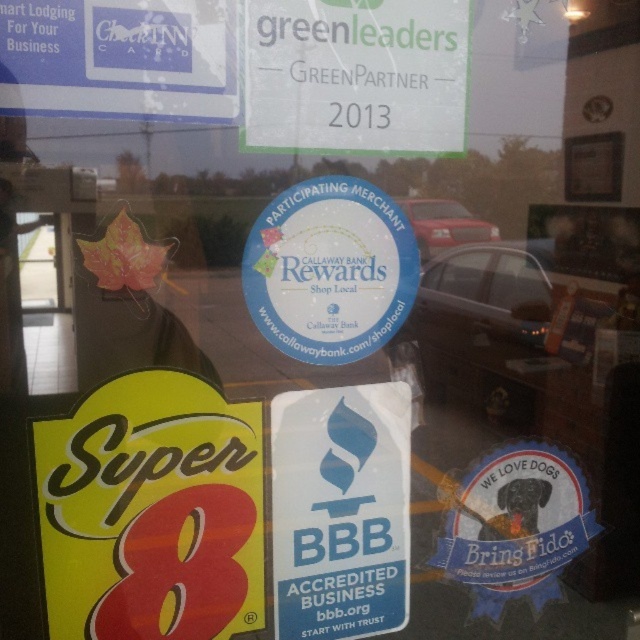
Question: Is green paper sign at upper center to the left of blue fabric dog at lower right from the viewer's perspective?

Choices:
 (A) yes
 (B) no

Answer: (A)

Question: Which is nearer to the green paper sign at upper center?

Choices:
 (A) blue paper sticker at center
 (B) white paper sign at upper left
 (C) white paper sticker at center

Answer: (A)

Question: Is yellow matte sign at lower left wider than white paper sticker at center?

Choices:
 (A) no
 (B) yes

Answer: (B)

Question: Which of the following is the closest to the observer?

Choices:
 (A) green paper sign at upper center
 (B) yellow matte sign at lower left
 (C) white paper sticker at center

Answer: (B)

Question: Which object appears closest to the camera in this image?

Choices:
 (A) yellow matte sign at lower left
 (B) white paper sticker at center
 (C) green paper sign at upper center
 (D) white paper sign at upper left

Answer: (D)

Question: Is green paper sign at upper center closer to the viewer compared to blue paper sticker at center?

Choices:
 (A) no
 (B) yes

Answer: (B)